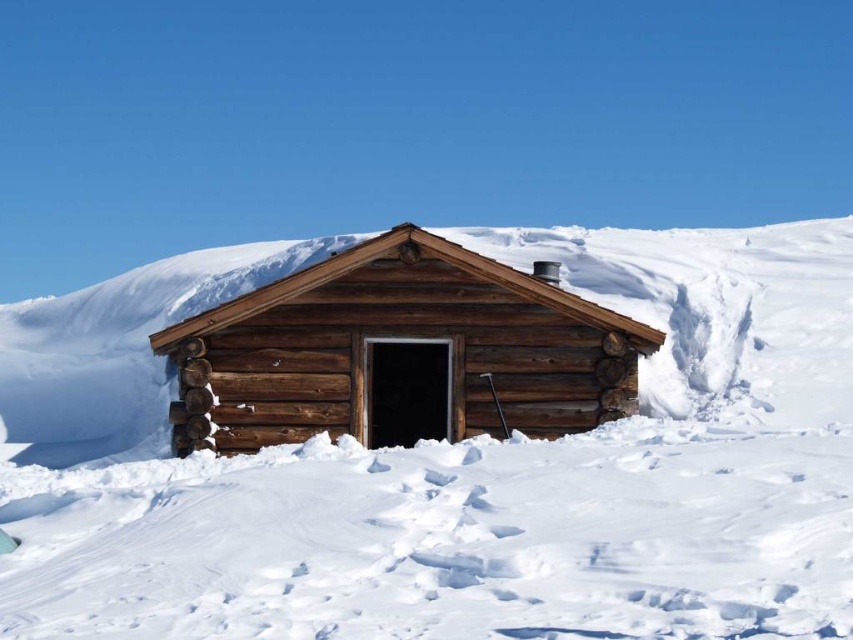
Question: Which of the following is the closest to the observer?

Choices:
 (A) (526, 259)
 (B) (509, 417)

Answer: (B)

Question: Which object is farther from the camera taking this photo?

Choices:
 (A) natural wood log cabin at center
 (B) white fluffy snow at center

Answer: (A)

Question: Does white fluffy snow at center come in front of natural wood log cabin at center?

Choices:
 (A) no
 (B) yes

Answer: (B)

Question: Which object is closer to the camera taking this photo?

Choices:
 (A) white fluffy snow at center
 (B) natural wood log cabin at center

Answer: (A)

Question: Can you confirm if white fluffy snow at center is thinner than natural wood log cabin at center?

Choices:
 (A) no
 (B) yes

Answer: (A)

Question: Is white fluffy snow at center bigger than natural wood log cabin at center?

Choices:
 (A) no
 (B) yes

Answer: (B)